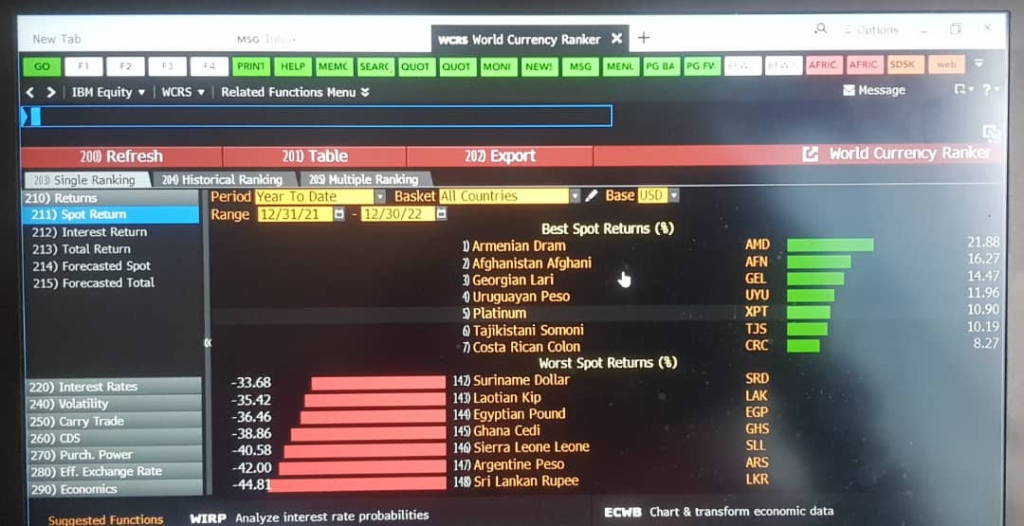
Locate an element on the screen. bar is located at coordinates (820, 225).